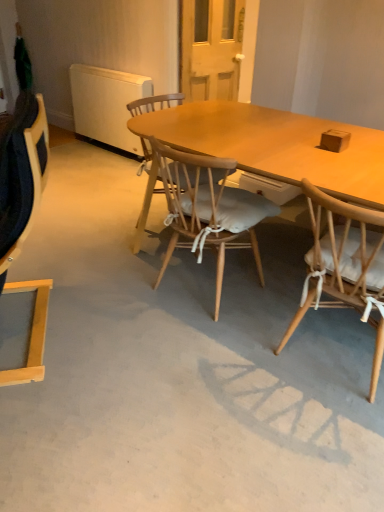
Locate an element on the screen. free point to the left of wooden chair with white cushion at right, the 3th chair from the left is located at coordinates (233, 361).